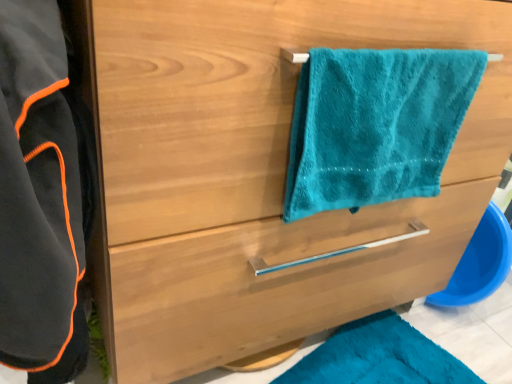
This screenshot has width=512, height=384. In order to click on empty space that is ontop of satin wood drawer at center in this screenshot , I will do `click(411, 336)`.